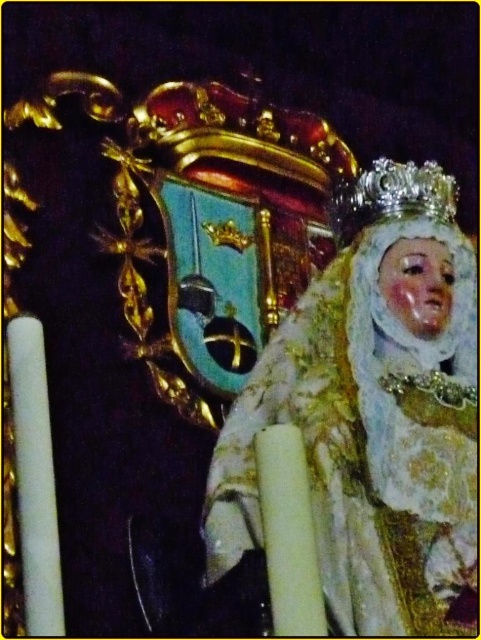
Does porcelain statue at center appear on the left side of silver/golden metallic crown at upper center?

Correct, you'll find porcelain statue at center to the left of silver/golden metallic crown at upper center.

Does point (354, 275) lie behind point (430, 193)?

No.

Describe the element at coordinates (374, 413) in the screenshot. This screenshot has height=640, width=481. I see `porcelain statue at center` at that location.

Locate an element on the screen. porcelain statue at center is located at coordinates (374, 413).